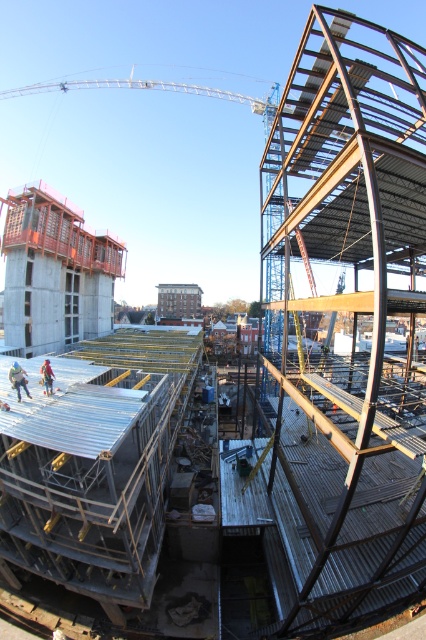
Question: Among these objects, which one is farthest from the camera?

Choices:
 (A) blue jeans construction worker at lower left
 (B) orange safety vest at center

Answer: (B)

Question: Does blue jeans construction worker at lower left come in front of orange safety vest at center?

Choices:
 (A) yes
 (B) no

Answer: (A)

Question: Can you confirm if blue jeans construction worker at lower left is wider than orange safety vest at center?

Choices:
 (A) no
 (B) yes

Answer: (A)

Question: Which object appears farthest from the camera in this image?

Choices:
 (A) orange safety vest at center
 (B) blue jeans construction worker at lower left

Answer: (A)

Question: Does blue jeans construction worker at lower left come behind orange safety vest at center?

Choices:
 (A) yes
 (B) no

Answer: (B)